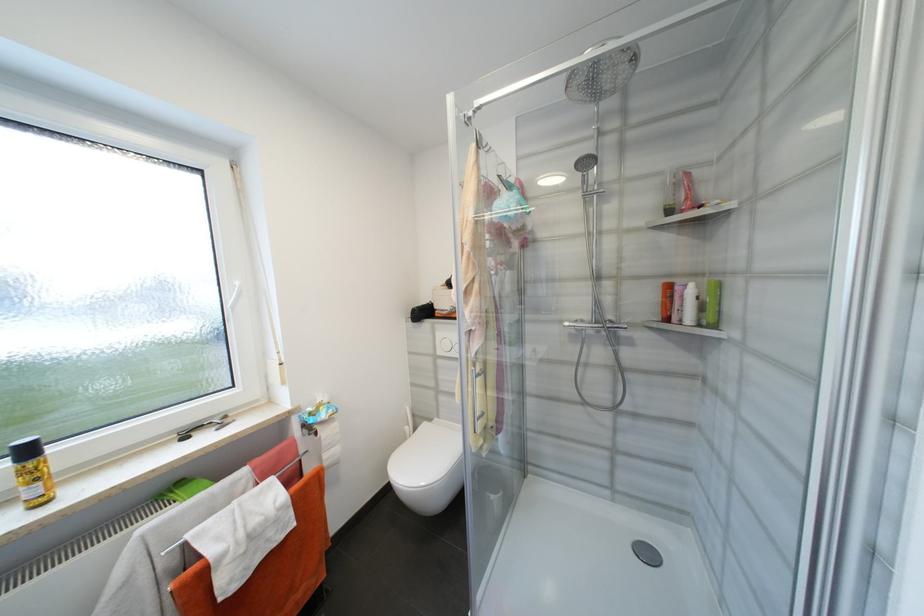
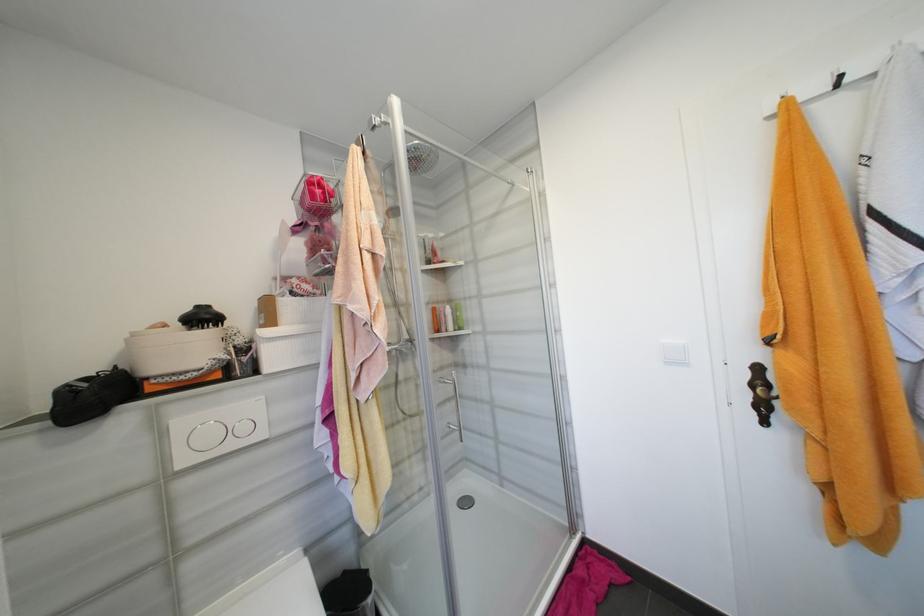
Question: The camera is either moving clockwise (left) or counter-clockwise (right) around the object. The first image is from the beginning of the video and the second image is from the end. Is the camera moving left or right when shooting the video?

Choices:
 (A) Left
 (B) Right

Answer: (A)